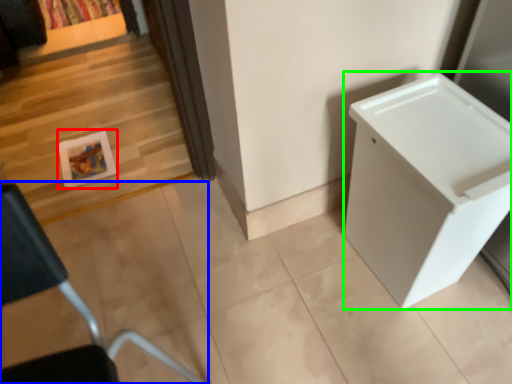
Question: Estimate the real-world distances between objects in this image. Which object is farther from picture frame (highlighted by a red box), furniture (highlighted by a blue box) or changing table (highlighted by a green box)?

Choices:
 (A) furniture
 (B) changing table

Answer: (B)